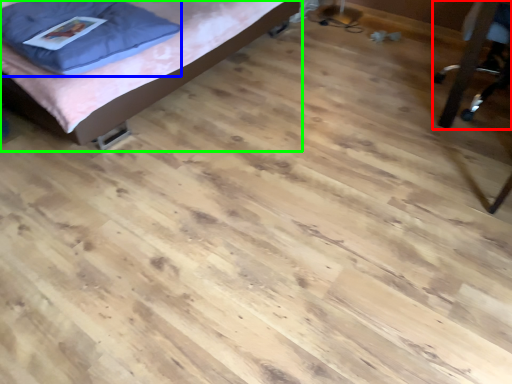
Question: Which is farther away from furniture (highlighted by a red box)? pillow (highlighted by a blue box) or bed (highlighted by a green box)?

Choices:
 (A) pillow
 (B) bed

Answer: (A)